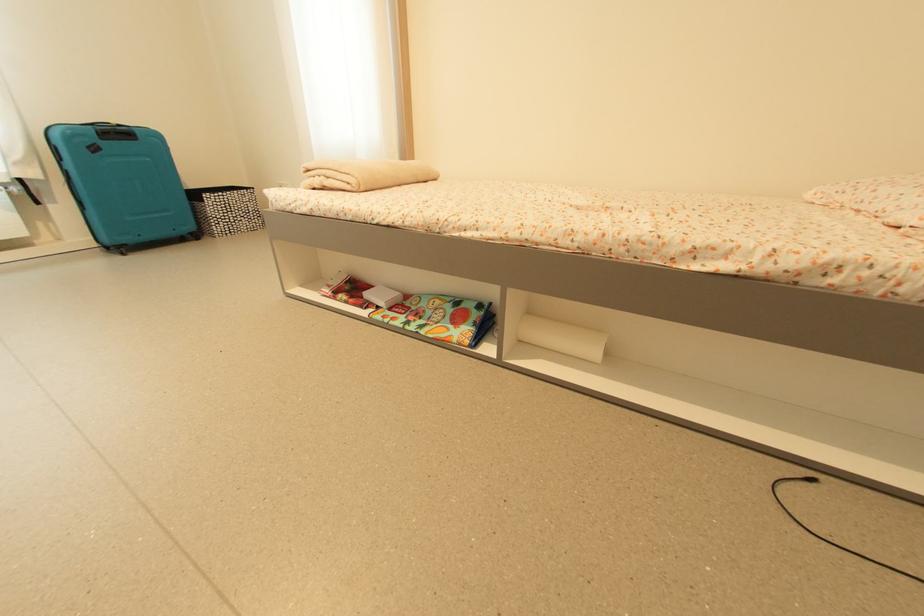
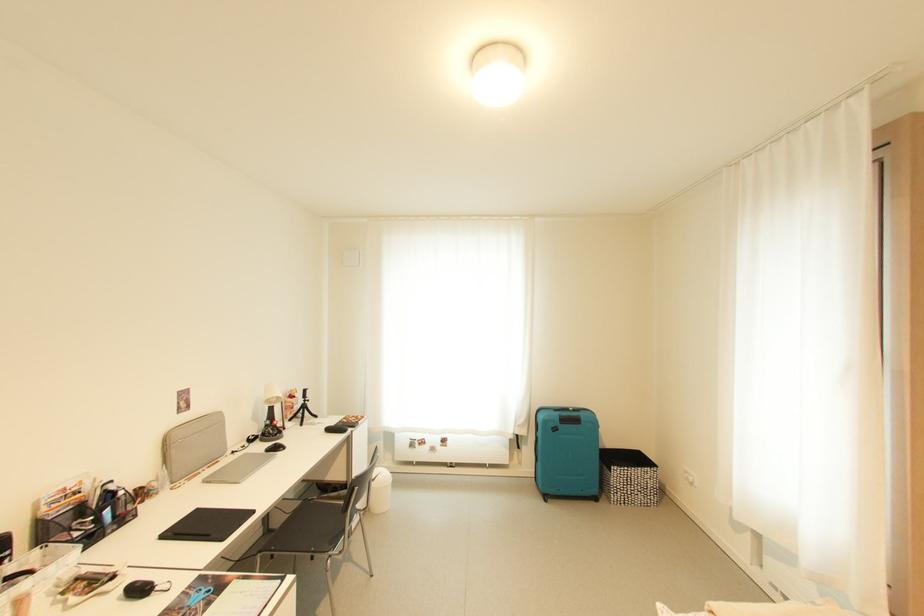
Locate, in the second image, the point that corresponds to the point at 213,212 in the first image.

(617, 482)